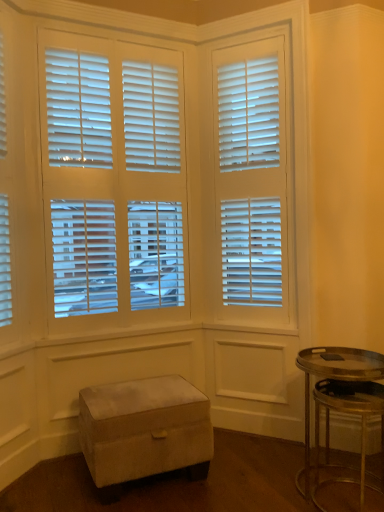
Find the location of a particular element. The image size is (384, 512). suede ottoman at lower left is located at coordinates (x=143, y=428).

The width and height of the screenshot is (384, 512). What do you see at coordinates (143, 428) in the screenshot?
I see `suede ottoman at lower left` at bounding box center [143, 428].

The width and height of the screenshot is (384, 512). What do you see at coordinates (334, 377) in the screenshot? I see `metallic gold table at lower right` at bounding box center [334, 377].

The height and width of the screenshot is (512, 384). Find the location of `metallic gold table at lower right`. metallic gold table at lower right is located at coordinates (334, 377).

At what (x,y) coordinates should I click in order to perform the action: click on suede ottoman at lower left. Please return your answer as a coordinate pair (x, y). The width and height of the screenshot is (384, 512). Looking at the image, I should click on coord(143,428).

Which is more to the right, suede ottoman at lower left or metallic gold table at lower right?

metallic gold table at lower right.

Is suede ottoman at lower left behind metallic gold table at lower right?

Yes, suede ottoman at lower left is further from the viewer.

Does point (105, 483) lie behind point (348, 348)?

No.

From the image's perspective, is suede ottoman at lower left above or below metallic gold table at lower right?

suede ottoman at lower left is below metallic gold table at lower right.

From a real-world perspective, which object rests below the other?

suede ottoman at lower left, from a real-world perspective.

Can you confirm if suede ottoman at lower left is wider than metallic gold table at lower right?

Yes.

Looking at this image, is suede ottoman at lower left taller or shorter than metallic gold table at lower right?

In the image, suede ottoman at lower left appears to be shorter than metallic gold table at lower right.

Between suede ottoman at lower left and metallic gold table at lower right, which one has larger size?

Bigger between the two is suede ottoman at lower left.

Is suede ottoman at lower left not within metallic gold table at lower right?

Indeed, suede ottoman at lower left is completely outside metallic gold table at lower right.

Would you say suede ottoman at lower left is a long distance from metallic gold table at lower right?

No.

Does suede ottoman at lower left turn towards metallic gold table at lower right?

No, suede ottoman at lower left does not turn towards metallic gold table at lower right.

How many degrees apart are the facing directions of suede ottoman at lower left and metallic gold table at lower right?

The angular difference between suede ottoman at lower left and metallic gold table at lower right is 90 degrees.

How much distance is there between suede ottoman at lower left and metallic gold table at lower right?

suede ottoman at lower left and metallic gold table at lower right are 86.17 centimeters apart.

Where is `step stool that is below the metallic gold table at lower right (from the image's perspective)`? This screenshot has height=512, width=384. step stool that is below the metallic gold table at lower right (from the image's perspective) is located at coordinates (143, 428).

Between metallic gold table at lower right and suede ottoman at lower left, which one appears on the left side from the viewer's perspective?

Positioned to the left is suede ottoman at lower left.

Does metallic gold table at lower right lie in front of suede ottoman at lower left?

Yes.

Between point (308, 358) and point (115, 388), which one is positioned in front?

The point (308, 358) is more forward.

From the image's perspective, which is above, metallic gold table at lower right or suede ottoman at lower left?

metallic gold table at lower right is shown above in the image.

From a real-world perspective, does metallic gold table at lower right stand above suede ottoman at lower left?

Correct, in the physical world, metallic gold table at lower right is higher than suede ottoman at lower left.

Which object is wider, metallic gold table at lower right or suede ottoman at lower left?

suede ottoman at lower left.

From their relative heights in the image, would you say metallic gold table at lower right is taller or shorter than suede ottoman at lower left?

Considering their sizes, metallic gold table at lower right has more height than suede ottoman at lower left.

Which of these two, metallic gold table at lower right or suede ottoman at lower left, is bigger?

suede ottoman at lower left is bigger.

From the picture: Is metallic gold table at lower right completely or partially outside of suede ottoman at lower left?

Yes, metallic gold table at lower right is not within suede ottoman at lower left.

Is metallic gold table at lower right far away from suede ottoman at lower left?

No, there isn't a large distance between metallic gold table at lower right and suede ottoman at lower left.

Is suede ottoman at lower left at the back of metallic gold table at lower right?

metallic gold table at lower right does not have its back to suede ottoman at lower left.

How different are the orientations of metallic gold table at lower right and suede ottoman at lower left in degrees?

90 degrees separate the facing orientations of metallic gold table at lower right and suede ottoman at lower left.

At what (x,y) coordinates should I click in order to perform the action: click on table lying on the right of suede ottoman at lower left. Please return your answer as a coordinate pair (x, y). Looking at the image, I should click on (334, 377).

You are a GUI agent. You are given a task and a screenshot of the screen. Output one action in this format:
    pyautogui.click(x=<x>, y=<y>)
    Task: Click on the table on the right of suede ottoman at lower left
    This screenshot has width=384, height=512.
    Given the screenshot: What is the action you would take?
    pyautogui.click(x=334, y=377)

Find the location of a particular element. The width and height of the screenshot is (384, 512). step stool behind the metallic gold table at lower right is located at coordinates (143, 428).